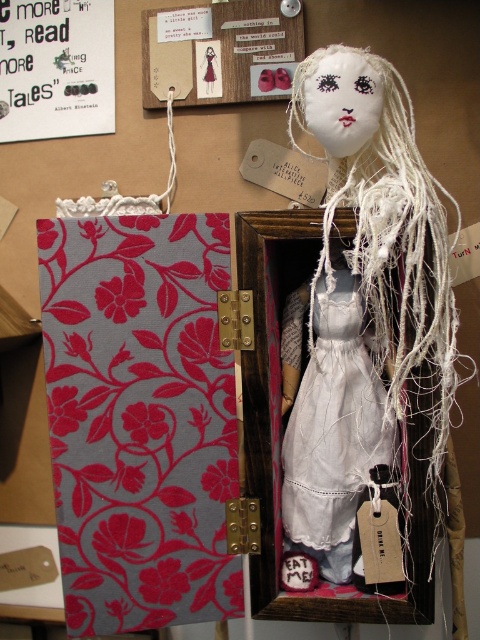
Question: Estimate the real-world distances between objects in this image. Which object is closer to the white fabric doll at center?

Choices:
 (A) floral fabric book at center
 (B) white cotton dress at center

Answer: (B)

Question: Among these points, which one is farthest from the camera?

Choices:
 (A) (302, 513)
 (B) (370, 397)

Answer: (B)

Question: Can you confirm if floral fabric book at center is positioned below white fabric doll at center?

Choices:
 (A) no
 (B) yes

Answer: (B)

Question: Does floral fabric book at center have a smaller size compared to white fabric doll at center?

Choices:
 (A) yes
 (B) no

Answer: (A)

Question: In this image, where is floral fabric book at center located relative to white fabric doll at center?

Choices:
 (A) right
 (B) left

Answer: (B)

Question: Which of the following is the farthest from the observer?

Choices:
 (A) (135, 468)
 (B) (311, 356)
 (C) (334, 369)

Answer: (B)